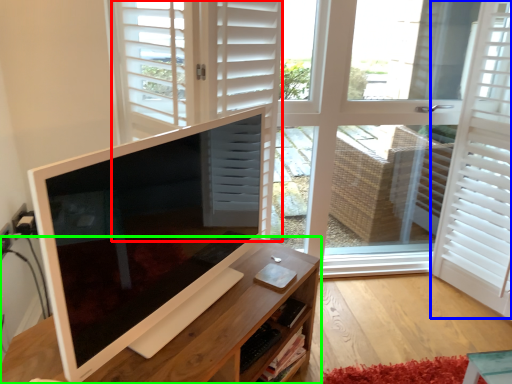
Question: Which object is the farthest from door (highlighted by a red box)? Choose among these: shutter (highlighted by a blue box) or desk (highlighted by a green box).

Choices:
 (A) shutter
 (B) desk

Answer: (A)